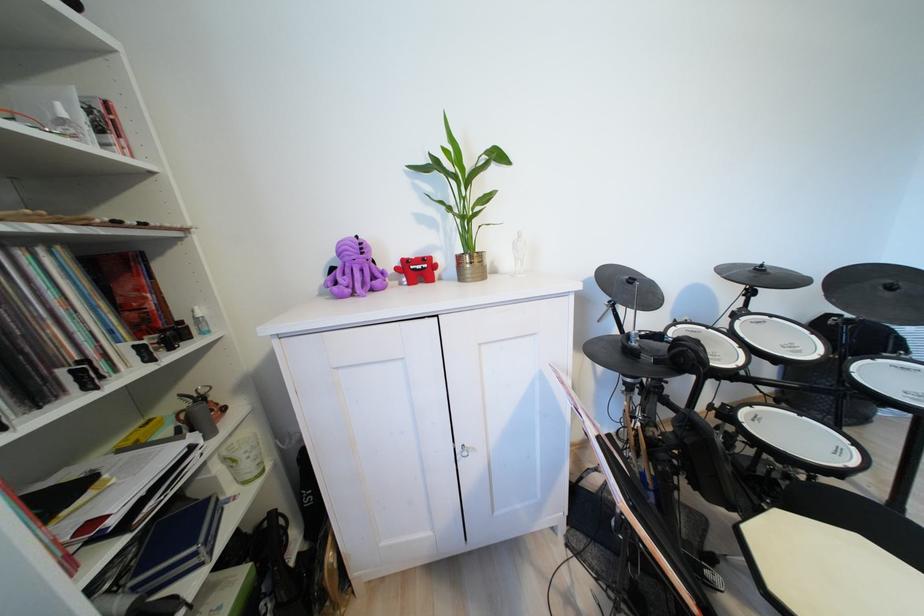
Locate an element on the screen. This screenshot has width=924, height=616. gold plant pot is located at coordinates (470, 265).